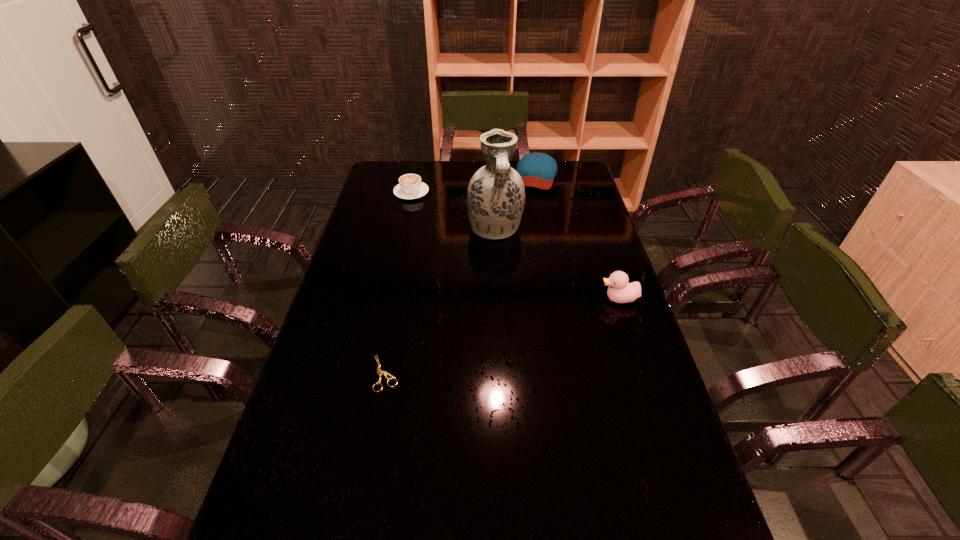
Where is `shears`? The width and height of the screenshot is (960, 540). shears is located at coordinates (379, 371).

Locate an element on the screen. This screenshot has width=960, height=540. the nearest object is located at coordinates coord(379,371).

Find the location of a particular element. Image resolution: width=960 pixels, height=540 pixels. the second tallest object is located at coordinates (620, 291).

Identify the location of the rightmost object. (620, 291).

Find the location of a particular element. the third farthest object is located at coordinates (496, 194).

This screenshot has width=960, height=540. I want to click on the tallest object, so click(496, 194).

This screenshot has width=960, height=540. Identify the location of baseball cap. (538, 170).

The image size is (960, 540). I want to click on cappuccino, so click(410, 186).

Where is `free space located 0.330m on the right of the shears`? free space located 0.330m on the right of the shears is located at coordinates (524, 373).

The height and width of the screenshot is (540, 960). I want to click on vacant space located 0.170m on the front-facing side of the fourth shortest object, so click(544, 299).